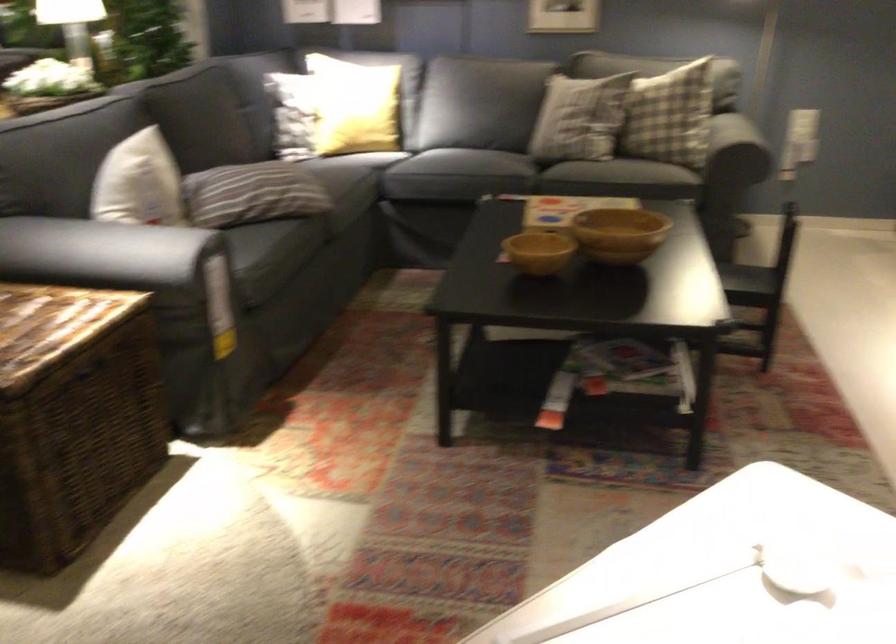
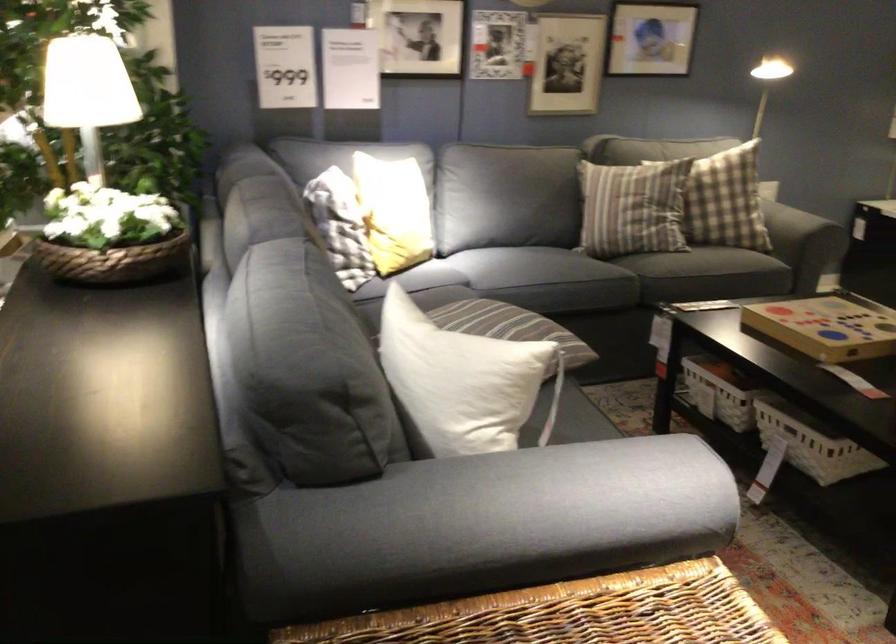
Question: I am providing you with two images of the same scene from different viewpoints. After the viewpoint changes to image2, which objects are now occluded?

Choices:
 (A) yellow pillow
 (B) white throw pillow
 (C) white storage basket
 (D) blue sofa pillow

Answer: (A)